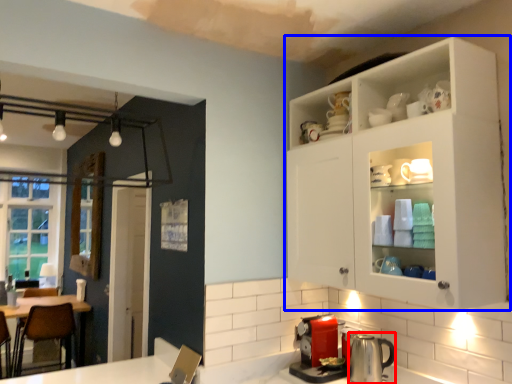
Question: Among these objects, which one is nearest to the camera, appliance (highlighted by a red box) or cabinetry (highlighted by a blue box)?

Choices:
 (A) appliance
 (B) cabinetry

Answer: (B)